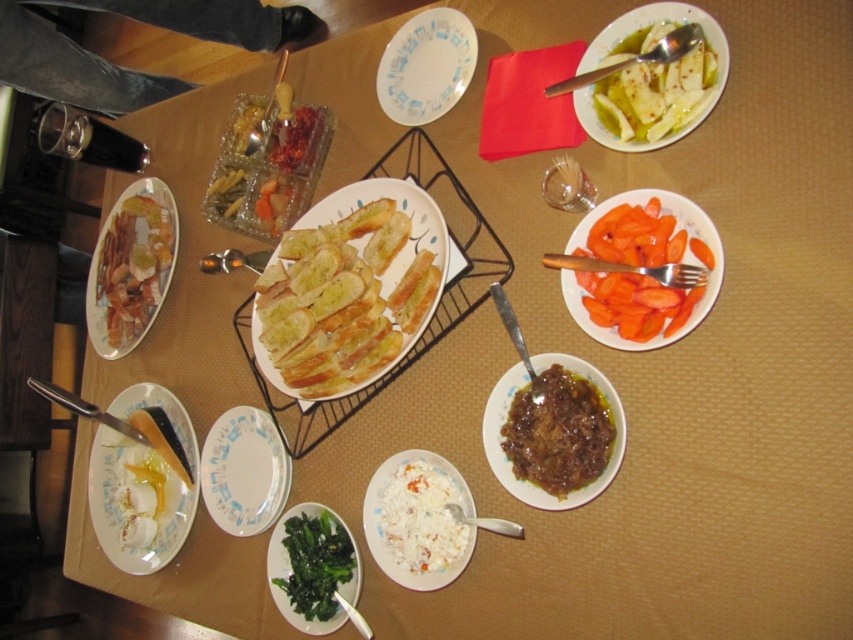
Question: Based on their relative distances, which object is nearer to the white glossy bowl at upper right?

Choices:
 (A) white glossy plate at lower left
 (B) white paper plate at lower left

Answer: (B)

Question: Is golden crispy bread at center further to the viewer compared to white paper plate at lower left?

Choices:
 (A) no
 (B) yes

Answer: (A)

Question: Which point appears closest to the camera in this image?

Choices:
 (A) (276, 326)
 (B) (136, 211)
 (C) (260, 516)

Answer: (A)

Question: Where is matte white plate at lower left located in relation to white glossy plate at lower left in the image?

Choices:
 (A) left
 (B) right

Answer: (A)

Question: Among these objects, which one is nearest to the camera?

Choices:
 (A) white matte rice bowl at center
 (B) matte white plate at lower left
 (C) sliced orange carrots at center right

Answer: (C)

Question: Is white matte rice bowl at center behind white paper plate at lower left?

Choices:
 (A) yes
 (B) no

Answer: (B)